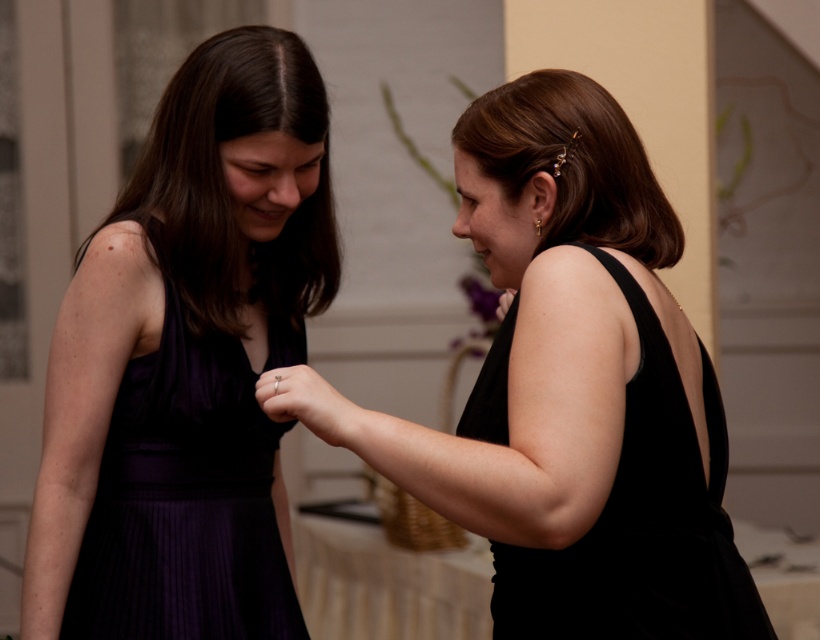
Based on the photo, you are standing in the room and need to locate the purple satin dress at left. According to the coordinates provided, where would you find it?

The purple satin dress at left is located at coordinates point [184,499].